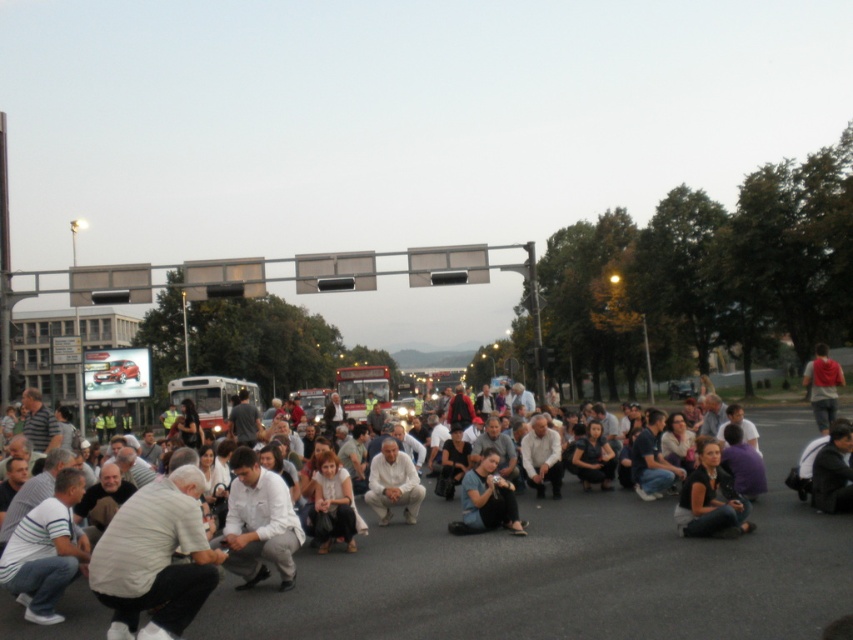
You are a photographer trying to capture a shot of the protest scene. You notice two people wearing white shirts. One is wearing a white striped shirt at lower left and the other a white matte shirt at center. Which person should you focus on to ensure their shirt is clearly visible in the photo?

You should focus on the white matte shirt at center because it occupies more space in the image than the white striped shirt at lower left, making it easier to capture clearly.

You are a photographer standing in the crowd and want to capture both the point at coordinates (241, 483) and the point at coordinates (728, 474) in a single photo. Which point will appear larger in the photo?

Point at coordinates (241, 483) will appear larger in the photo because it is closer to the viewer than point at coordinates (728, 474).